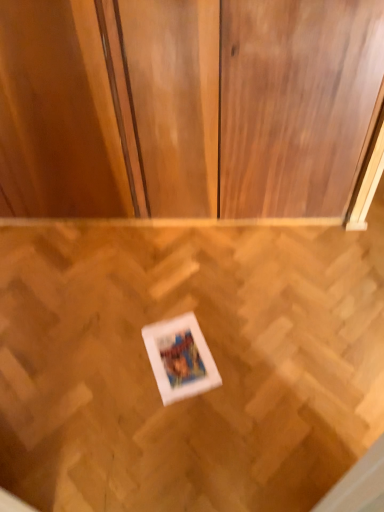
The image size is (384, 512). Identify the location of vacant space in front of matte wood dresser at center. (174, 326).